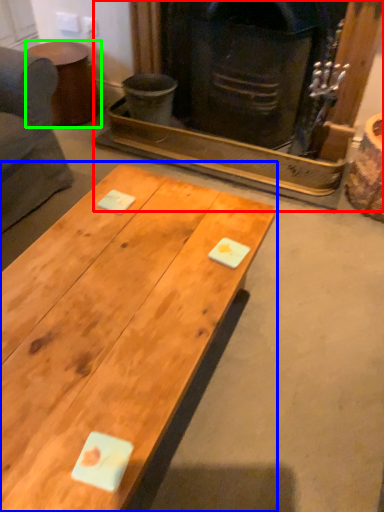
Question: Considering the real-world distances, which object is closest to fireplace (highlighted by a red box)? coffee table (highlighted by a blue box) or side table (highlighted by a green box).

Choices:
 (A) coffee table
 (B) side table

Answer: (B)